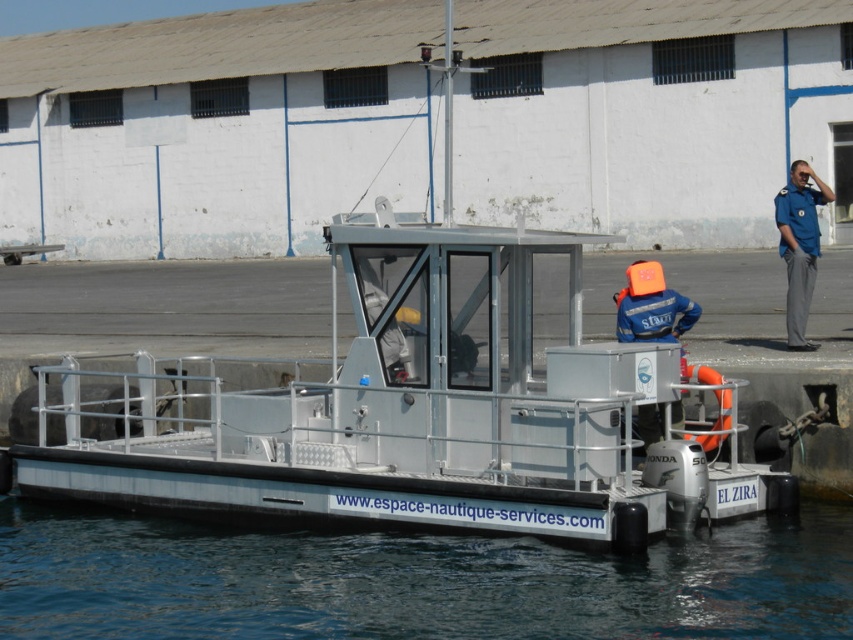
Based on the scene description, where is the blue water at lower center located in 2D coordinates?

The blue water at lower center is located at the 2D coordinates point (415, 580).

You are a safety inspector checking the boat for proper equipment placement. According to the image, where is the orange rubber life jacket at right in relation to the blue uniform at upper right?

The orange rubber life jacket at right is behind the blue uniform at upper right.